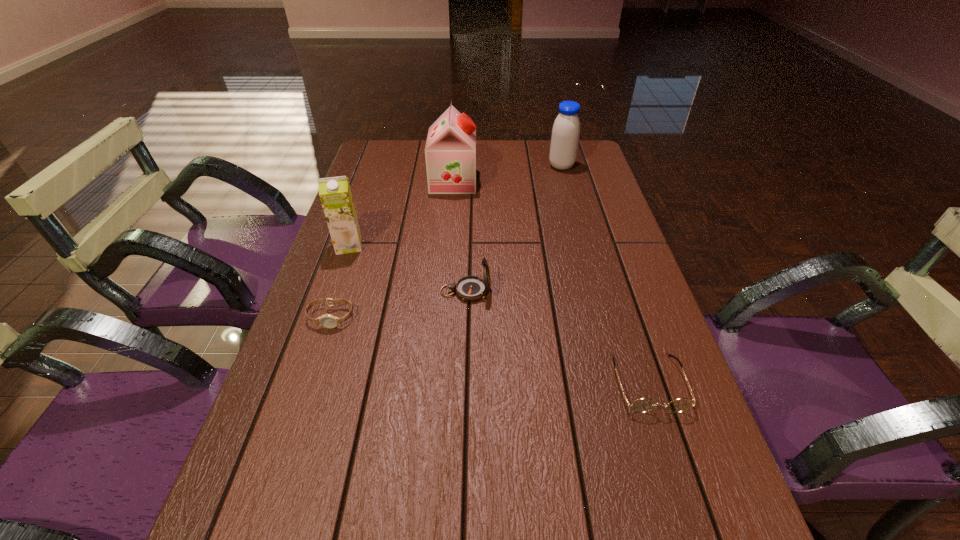
In the image, there is a desktop. Where is `vacant space at the right edge`? The height and width of the screenshot is (540, 960). vacant space at the right edge is located at coordinates pyautogui.click(x=566, y=200).

Find the location of a particular element. The height and width of the screenshot is (540, 960). unoccupied position between the rightmost soya milk and the compass is located at coordinates (514, 229).

This screenshot has height=540, width=960. What are the coordinates of `empty space that is in between the spectacles and the second soya milk from right to left` in the screenshot? It's located at (551, 282).

The image size is (960, 540). What are the coordinates of `vacant point located between the nearest soya milk and the third nearest object` in the screenshot? It's located at (407, 268).

Find the location of a particular element. Image resolution: width=960 pixels, height=540 pixels. vacant area that lies between the nearest soya milk and the second soya milk from right to left is located at coordinates (401, 213).

In order to click on vacant area that lies between the watch and the third farthest object in this screenshot , I will do `click(340, 281)`.

Where is `free space between the nearest object and the leftmost soya milk`? The image size is (960, 540). free space between the nearest object and the leftmost soya milk is located at coordinates (498, 314).

The image size is (960, 540). I want to click on free space between the rightmost soya milk and the fourth farthest object, so click(514, 229).

The height and width of the screenshot is (540, 960). In order to click on free space that is in between the rightmost soya milk and the second soya milk from right to left in this screenshot , I will do `click(507, 174)`.

At what (x,y) coordinates should I click in order to perform the action: click on vacant space that is in between the rightmost soya milk and the spectacles. Please return your answer as a coordinate pair (x, y). Looking at the image, I should click on (605, 274).